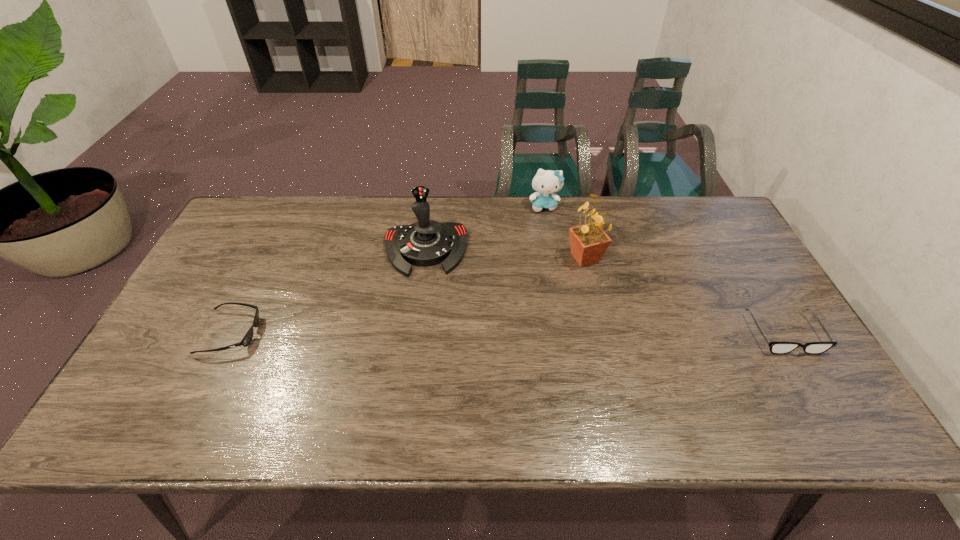
Locate an element on the screen. This screenshot has width=960, height=540. free space located 0.300m at the front of the sunflower with flowers visible is located at coordinates (545, 346).

This screenshot has height=540, width=960. Find the location of `free location located 0.370m at the front of the sunflower with flowers visible`. free location located 0.370m at the front of the sunflower with flowers visible is located at coordinates (536, 367).

This screenshot has height=540, width=960. What are the coordinates of `vacant point located 0.370m on the handle side of the joystick` in the screenshot? It's located at (430, 392).

At what (x,y) coordinates should I click in order to perform the action: click on free location located on the handle side of the joystick. Please return your answer as a coordinate pair (x, y). Image resolution: width=960 pixels, height=540 pixels. Looking at the image, I should click on (427, 291).

Find the location of a particular element. vacant area situated 0.370m on the handle side of the joystick is located at coordinates (430, 392).

What are the coordinates of `vacant area situated 0.080m on the face of the kitten` in the screenshot? It's located at (550, 230).

Image resolution: width=960 pixels, height=540 pixels. Find the location of `vacant area situated 0.050m on the face of the kitten`. vacant area situated 0.050m on the face of the kitten is located at coordinates (549, 224).

At what (x,y) coordinates should I click in order to perform the action: click on blank area located on the face of the kitten. Please return your answer as a coordinate pair (x, y). The width and height of the screenshot is (960, 540). Looking at the image, I should click on (552, 238).

This screenshot has width=960, height=540. In order to click on joystick that is positioned at the far edge in this screenshot , I will do `click(425, 243)`.

Locate an element on the screen. The width and height of the screenshot is (960, 540). kitten that is at the far edge is located at coordinates (546, 182).